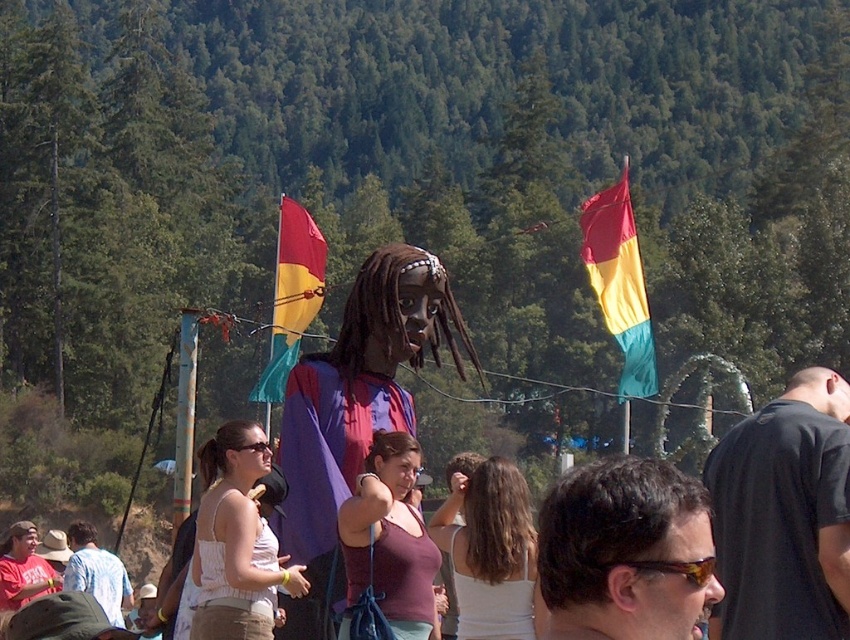
Consider the image. You are standing in the festival scene and need to determine which of the two points, point (816, 621) or point (626, 298), is nearer to you. Which one is closer?

Point (816, 621) is closer to the viewer than point (626, 298).